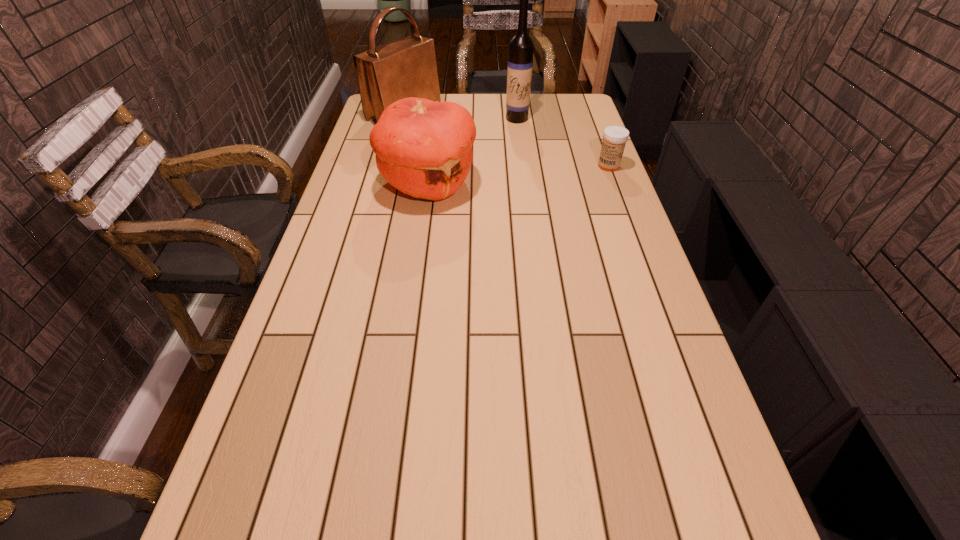
Where is `blank area located on the front flap of the shoulder bag`? The width and height of the screenshot is (960, 540). blank area located on the front flap of the shoulder bag is located at coordinates (468, 143).

Where is `vacant space located 0.120m on the front flap of the shoulder bag`? This screenshot has width=960, height=540. vacant space located 0.120m on the front flap of the shoulder bag is located at coordinates point(453,137).

You are a GUI agent. You are given a task and a screenshot of the screen. Output one action in this format:
    pyautogui.click(x=<x>, y=<y>)
    Task: Click on the vacant space situated 0.370m on the front flap of the shoulder bag
    The width and height of the screenshot is (960, 540).
    Given the screenshot: What is the action you would take?
    pyautogui.click(x=506, y=158)

At what (x,y) coordinates should I click in order to perform the action: click on wine bottle that is at the far edge. Please return your answer as a coordinate pair (x, y). The height and width of the screenshot is (540, 960). Looking at the image, I should click on pyautogui.click(x=520, y=59).

Locate an element on the screen. Image resolution: width=960 pixels, height=540 pixels. shoulder bag that is at the far edge is located at coordinates (403, 68).

The height and width of the screenshot is (540, 960). I want to click on pumpkin at the left edge, so click(423, 148).

Where is `shoulder bag that is at the left edge`? Image resolution: width=960 pixels, height=540 pixels. shoulder bag that is at the left edge is located at coordinates (403, 68).

Identify the location of object that is at the right edge. Image resolution: width=960 pixels, height=540 pixels. (614, 137).

The image size is (960, 540). Identify the location of object at the far left corner. (403, 68).

Image resolution: width=960 pixels, height=540 pixels. In order to click on free region at the far edge of the desktop in this screenshot , I will do `click(501, 105)`.